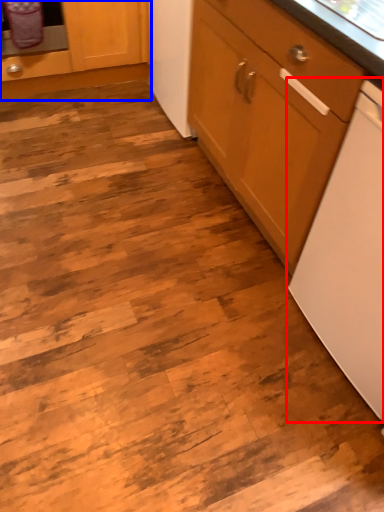
Question: Which point is further to the camera, home appliance (highlighted by a red box) or cabinetry (highlighted by a blue box)?

Choices:
 (A) home appliance
 (B) cabinetry

Answer: (B)